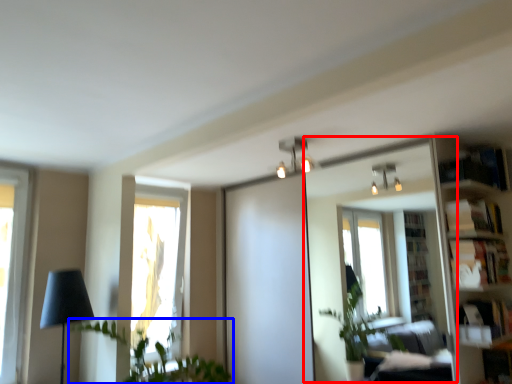
Question: Among these objects, which one is farthest to the camera, mirror (highlighted by a red box) or houseplant (highlighted by a blue box)?

Choices:
 (A) mirror
 (B) houseplant

Answer: (A)